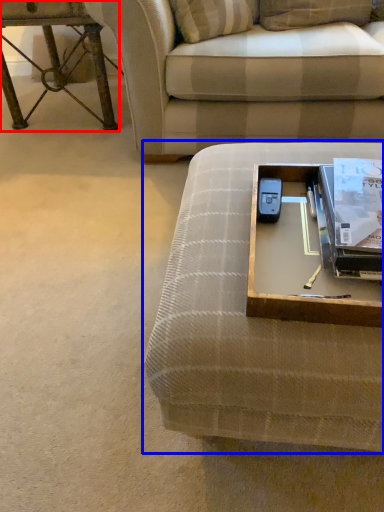
Question: Which object appears farthest to the camera in this image, table (highlighted by a red box) or studio couch (highlighted by a blue box)?

Choices:
 (A) table
 (B) studio couch

Answer: (A)